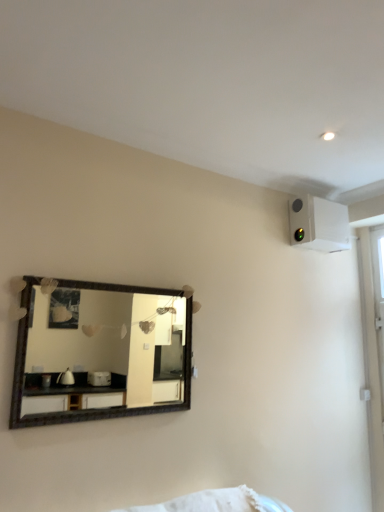
Question: Is white plastic air conditioning unit at upper right placed right next to wooden-framed mirror at upper left?

Choices:
 (A) no
 (B) yes

Answer: (A)

Question: Is white plastic air conditioning unit at upper right not near wooden-framed mirror at upper left?

Choices:
 (A) no
 (B) yes

Answer: (B)

Question: Considering the relative positions of white plastic air conditioning unit at upper right and wooden-framed mirror at upper left in the image provided, is white plastic air conditioning unit at upper right to the right of wooden-framed mirror at upper left from the viewer's perspective?

Choices:
 (A) yes
 (B) no

Answer: (A)

Question: Is wooden-framed mirror at upper left at the back of white plastic air conditioning unit at upper right?

Choices:
 (A) no
 (B) yes

Answer: (A)

Question: Is white plastic air conditioning unit at upper right facing towards wooden-framed mirror at upper left?

Choices:
 (A) yes
 (B) no

Answer: (B)

Question: Is white plastic air conditioning unit at upper right surrounding wooden-framed mirror at upper left?

Choices:
 (A) yes
 (B) no

Answer: (B)

Question: Can you confirm if wooden-framed mirror at upper left is smaller than white plastic air conditioning unit at upper right?

Choices:
 (A) no
 (B) yes

Answer: (B)

Question: Is wooden-framed mirror at upper left to the left of white plastic air conditioning unit at upper right from the viewer's perspective?

Choices:
 (A) yes
 (B) no

Answer: (A)

Question: Is wooden-framed mirror at upper left thinner than white plastic air conditioning unit at upper right?

Choices:
 (A) yes
 (B) no

Answer: (A)

Question: Does wooden-framed mirror at upper left have a greater height compared to white plastic air conditioning unit at upper right?

Choices:
 (A) no
 (B) yes

Answer: (B)

Question: Considering the relative sizes of wooden-framed mirror at upper left and white plastic air conditioning unit at upper right in the image provided, is wooden-framed mirror at upper left bigger than white plastic air conditioning unit at upper right?

Choices:
 (A) no
 (B) yes

Answer: (A)

Question: Does wooden-framed mirror at upper left have a greater width compared to white plastic air conditioning unit at upper right?

Choices:
 (A) no
 (B) yes

Answer: (A)

Question: From their relative heights in the image, would you say wooden-framed mirror at upper left is taller or shorter than white plastic air conditioning unit at upper right?

Choices:
 (A) tall
 (B) short

Answer: (A)